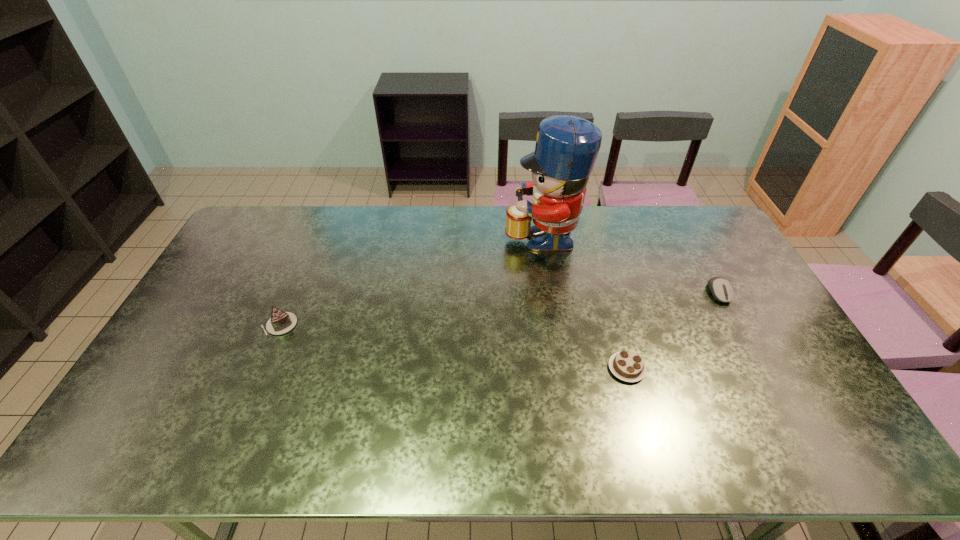
Identify which object is the third nearest to the shortest object. Please provide its 2D coordinates. Your answer should be formatted as a tuple, i.e. [(x, y)], where the tuple contains the x and y coordinates of a point satisfying the conditions above.

[(281, 322)]

In order to click on the third closest object relative to the farthest object in this screenshot , I will do `click(281, 322)`.

The height and width of the screenshot is (540, 960). Identify the location of free space that satisfies the following two spatial constraints: 1. on the front-facing side of the tallest object; 2. on the back side of the shorter chocolate cake. (564, 368).

Locate an element on the screen. This screenshot has width=960, height=540. vacant space that satisfies the following two spatial constraints: 1. on the front-facing side of the shortest object; 2. on the left side of the tallest object is located at coordinates (564, 368).